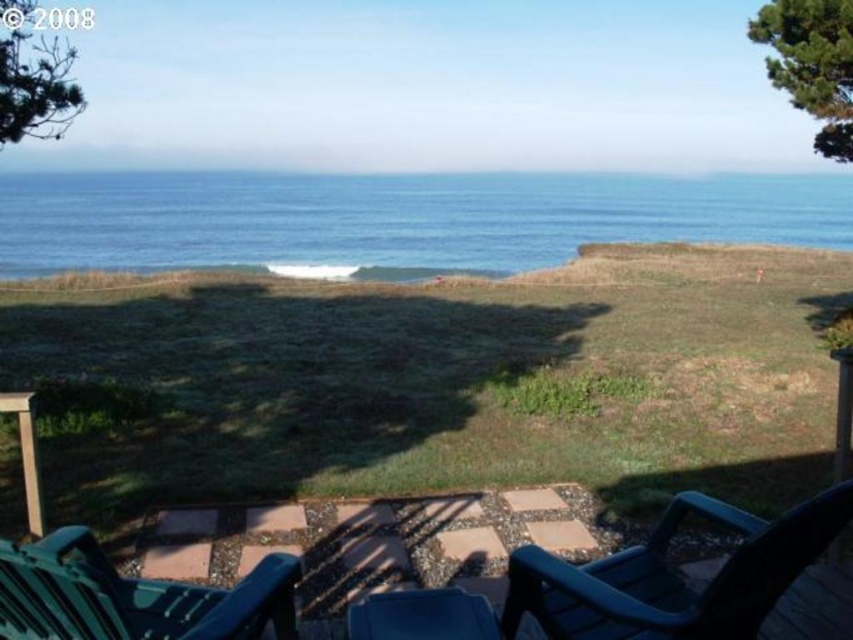
Question: Can you confirm if blue water at center is positioned to the right of green plastic chairs at lower center?

Choices:
 (A) no
 (B) yes

Answer: (A)

Question: Which of the following is the farthest from the observer?

Choices:
 (A) green plastic chair at lower left
 (B) black plastic rocking chair at lower right

Answer: (B)

Question: Can you confirm if green plastic chair at lower left is bigger than blue plastic chair at lower center?

Choices:
 (A) no
 (B) yes

Answer: (B)

Question: Based on their relative distances, which object is farther from the black plastic rocking chair at lower right?

Choices:
 (A) green plastic chairs at lower center
 (B) blue plastic chair at lower center
 (C) blue water at center

Answer: (C)

Question: Which object is the closest to the green plastic chairs at lower center?

Choices:
 (A) blue plastic chair at lower center
 (B) green plastic chair at lower left
 (C) blue water at center
 (D) black plastic rocking chair at lower right

Answer: (D)

Question: Considering the relative positions of black plastic rocking chair at lower right and green plastic chair at lower left in the image provided, where is black plastic rocking chair at lower right located with respect to green plastic chair at lower left?

Choices:
 (A) right
 (B) left

Answer: (A)